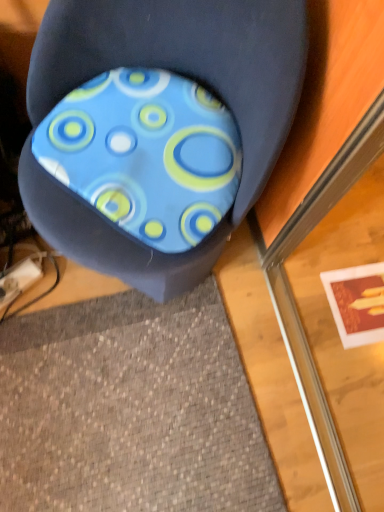
Question: Would you say blue fabric cushion at center is inside or outside blue fabric cushion at center?

Choices:
 (A) outside
 (B) inside

Answer: (A)

Question: From the image's perspective, is blue fabric cushion at center above or below blue fabric cushion at center?

Choices:
 (A) above
 (B) below

Answer: (B)

Question: Looking at the image, does blue fabric cushion at center seem bigger or smaller compared to blue fabric cushion at center?

Choices:
 (A) big
 (B) small

Answer: (A)

Question: Looking at the image, does blue fabric cushion at center seem bigger or smaller compared to blue fabric cushion at center?

Choices:
 (A) big
 (B) small

Answer: (B)

Question: Is point (33, 141) positioned closer to the camera than point (205, 176)?

Choices:
 (A) closer
 (B) farther

Answer: (B)

Question: Considering their positions, is blue fabric cushion at center located in front of or behind blue fabric cushion at center?

Choices:
 (A) front
 (B) behind

Answer: (B)

Question: From a real-world perspective, is blue fabric cushion at center positioned above or below blue fabric cushion at center?

Choices:
 (A) above
 (B) below

Answer: (A)